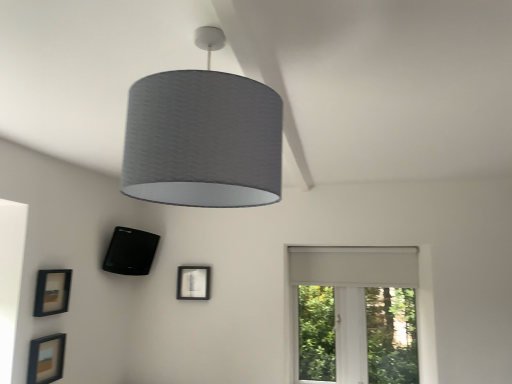
What do you see at coordinates (203, 137) in the screenshot?
I see `textured gray lampshade at center` at bounding box center [203, 137].

Measure the distance between point (61, 275) and camera.

Point (61, 275) is 2.58 meters from camera.

The image size is (512, 384). What do you see at coordinates (46, 359) in the screenshot? I see `matte black picture frame at lower left, arranged as the 1th picture frame when viewed from the front` at bounding box center [46, 359].

What is the approximate width of white matte window at right?

white matte window at right is 4.70 inches wide.

At what (x,y) coordinates should I click in order to perform the action: click on white matte window at right. Please return your answer as a coordinate pair (x, y). This screenshot has height=384, width=512. Looking at the image, I should click on (362, 300).

Find the location of `black matte speaker at lower left, acting as the first picture frame starting from the right`. black matte speaker at lower left, acting as the first picture frame starting from the right is located at coordinates (130, 252).

From a real-world perspective, is black matte speaker at lower left, which ranks as the third picture frame in front-to-back order, under white matte window at right?

Actually, black matte speaker at lower left, which ranks as the third picture frame in front-to-back order, is physically above white matte window at right in the real world.

Which object is positioned more to the right, black matte speaker at lower left, which ranks as the third picture frame in front-to-back order, or white matte window at right?

Positioned to the right is white matte window at right.

Looking at their sizes, would you say black matte speaker at lower left, the first picture frame viewed from the back, is wider or thinner than white matte window at right?

In the image, black matte speaker at lower left, the first picture frame viewed from the back, appears to be wider than white matte window at right.

Can white matte window at right be found inside black matte speaker at lower left, the first picture frame viewed from the back?

Actually, white matte window at right is outside black matte speaker at lower left, the first picture frame viewed from the back.

How much distance is there between textured gray lampshade at center and matte black picture frame at lower left, marked as the 2th picture frame in a left-to-right arrangement?

textured gray lampshade at center and matte black picture frame at lower left, marked as the 2th picture frame in a left-to-right arrangement, are 5.85 feet apart from each other.

Which object is more forward, textured gray lampshade at center or matte black picture frame at lower left, the second picture frame positioned from the front?

textured gray lampshade at center is closer to the camera.

What's the angular difference between textured gray lampshade at center and matte black picture frame at lower left, placed as the 2th picture frame when sorted from right to left,'s facing directions?

textured gray lampshade at center and matte black picture frame at lower left, placed as the 2th picture frame when sorted from right to left, are facing 94 degrees away from each other.

Between textured gray lampshade at center and matte black picture frame at lower left, the second picture frame positioned from the front, which one has more height?

Standing taller between the two is textured gray lampshade at center.

Is white matte window at right located outside textured gray lampshade at center?

white matte window at right lies outside textured gray lampshade at center's area.

Considering the relative sizes of white matte window at right and textured gray lampshade at center in the image provided, is white matte window at right bigger than textured gray lampshade at center?

Yes.

Which is in front, point (385, 266) or point (264, 117)?

The point (264, 117) is closer to the camera.

Is white matte window at right wider or thinner than textured gray lampshade at center?

Considering their sizes, white matte window at right looks slimmer than textured gray lampshade at center.

Are matte black picture frame at lower left, placed as the 2th picture frame when sorted from right to left, and white matte window at right far apart?

Yes, matte black picture frame at lower left, placed as the 2th picture frame when sorted from right to left, and white matte window at right are quite far apart.

How many degrees apart are the facing directions of matte black picture frame at lower left, placed as the 2th picture frame when sorted from right to left, and white matte window at right?

They differ by 91.8 degrees in their facing directions.

Which of these two, matte black picture frame at lower left, the 2th picture frame positioned from the back, or white matte window at right, is thinner?

Thinner between the two is matte black picture frame at lower left, the 2th picture frame positioned from the back.

Considering the positions of objects matte black picture frame at lower left, the second picture frame positioned from the front, and white matte window at right in the image provided, who is more to the left, matte black picture frame at lower left, the second picture frame positioned from the front, or white matte window at right?

From the viewer's perspective, matte black picture frame at lower left, the second picture frame positioned from the front, appears more on the left side.

Is black matte speaker at lower left, the first picture frame viewed from the back, far from textured gray lampshade at center?

Indeed, black matte speaker at lower left, the first picture frame viewed from the back, is not near textured gray lampshade at center.

Which object is positioned more to the right, black matte speaker at lower left, acting as the first picture frame starting from the right, or textured gray lampshade at center?

From the viewer's perspective, textured gray lampshade at center appears more on the right side.

Find the location of a particular element. lamp above the black matte speaker at lower left, arranged as the 3th picture frame when viewed from the left (from the image's perspective) is located at coordinates (203, 137).

Is point (115, 253) positioned in front of point (252, 189)?

That is False.

Considering the relative sizes of matte black picture frame at lower left, the second picture frame positioned from the front, and textured gray lampshade at center in the image provided, is matte black picture frame at lower left, the second picture frame positioned from the front, wider than textured gray lampshade at center?

No.

Is point (45, 303) positioned before point (189, 121)?

No, (45, 303) is further to viewer.

Considering the sizes of objects matte black picture frame at lower left, placed as the 2th picture frame when sorted from right to left, and textured gray lampshade at center in the image provided, who is taller, matte black picture frame at lower left, placed as the 2th picture frame when sorted from right to left, or textured gray lampshade at center?

textured gray lampshade at center is taller.

From a real-world perspective, is matte black picture frame at lower left, the 2th picture frame positioned from the back, physically located above or below matte black picture frame at lower left, the third picture frame from the right?

Clearly, from a real-world perspective, matte black picture frame at lower left, the 2th picture frame positioned from the back, is above matte black picture frame at lower left, the third picture frame from the right.

Considering the positions of objects matte black picture frame at lower left, the 2th picture frame positioned from the back, and matte black picture frame at lower left, which is the 1th picture frame in left-to-right order, in the image provided, who is in front, matte black picture frame at lower left, the 2th picture frame positioned from the back, or matte black picture frame at lower left, which is the 1th picture frame in left-to-right order,?

matte black picture frame at lower left, which is the 1th picture frame in left-to-right order.

Is matte black picture frame at lower left, marked as the 2th picture frame in a left-to-right arrangement, surrounding matte black picture frame at lower left, the third picture frame from the right?

No, matte black picture frame at lower left, the third picture frame from the right, is not a part of matte black picture frame at lower left, marked as the 2th picture frame in a left-to-right arrangement.

Does matte black picture frame at lower left, placed as the 2th picture frame when sorted from right to left, have a larger size compared to matte black picture frame at lower left, the third picture frame from the right?

No.

Find the location of a particular element. window behind the black matte speaker at lower left, acting as the first picture frame starting from the right is located at coordinates (362, 300).

This screenshot has height=384, width=512. In order to click on lamp that appears in front of the matte black picture frame at lower left, the second picture frame positioned from the front in this screenshot , I will do `click(203, 137)`.

Which object lies nearer to the anchor point black matte speaker at lower left, the first picture frame viewed from the back, textured gray lampshade at center or matte black picture frame at lower left, marked as the 2th picture frame in a left-to-right arrangement?

Based on the image, matte black picture frame at lower left, marked as the 2th picture frame in a left-to-right arrangement, appears to be nearer to black matte speaker at lower left, the first picture frame viewed from the back.

Consider the image. Which object lies nearer to the anchor point black matte speaker at lower left, the first picture frame viewed from the back, matte black picture frame at lower left, the 3th picture frame viewed from the back, or textured gray lampshade at center?

matte black picture frame at lower left, the 3th picture frame viewed from the back, is closer to black matte speaker at lower left, the first picture frame viewed from the back.

Which object lies further to the anchor point white matte window at right, matte black picture frame at lower left, the 2th picture frame positioned from the back, or textured gray lampshade at center?

Among the two, textured gray lampshade at center is located further to white matte window at right.

Estimate the real-world distances between objects in this image. Which object is further from textured gray lampshade at center, black matte speaker at lower left, arranged as the 3th picture frame when viewed from the left, or white matte window at right?

white matte window at right is further to textured gray lampshade at center.

From the image, which object appears to be farther from black matte speaker at lower left, the first picture frame viewed from the back, matte black picture frame at lower left, placed as the 2th picture frame when sorted from right to left, or matte black picture frame at lower left, which is the 1th picture frame in left-to-right order?

matte black picture frame at lower left, which is the 1th picture frame in left-to-right order, is further to black matte speaker at lower left, the first picture frame viewed from the back.

Which object lies nearer to the anchor point matte black picture frame at lower left, the third picture frame from the right, textured gray lampshade at center or matte black picture frame at lower left, placed as the 2th picture frame when sorted from right to left?

matte black picture frame at lower left, placed as the 2th picture frame when sorted from right to left, is closer to matte black picture frame at lower left, the third picture frame from the right.

When comparing their distances from matte black picture frame at lower left, which is the 1th picture frame in left-to-right order, does white matte window at right or black matte speaker at lower left, which ranks as the third picture frame in front-to-back order, seem further?

white matte window at right is further to matte black picture frame at lower left, which is the 1th picture frame in left-to-right order.

Which object lies further to the anchor point white matte window at right, textured gray lampshade at center or matte black picture frame at lower left, marked as the 2th picture frame in a left-to-right arrangement?

Based on the image, textured gray lampshade at center appears to be further to white matte window at right.

Find the location of a particular element. picture frame located between textured gray lampshade at center and matte black picture frame at lower left, placed as the 2th picture frame when sorted from right to left, in the depth direction is located at coordinates (46, 359).

You are a GUI agent. You are given a task and a screenshot of the screen. Output one action in this format:
    pyautogui.click(x=<x>, y=<y>)
    Task: Click on the picture frame between matte black picture frame at lower left, the third picture frame from the right, and black matte speaker at lower left, the first picture frame viewed from the back, along the z-axis
    
    Given the screenshot: What is the action you would take?
    pyautogui.click(x=52, y=292)

Locate an element on the screen. picture frame between matte black picture frame at lower left, marked as the 2th picture frame in a left-to-right arrangement, and white matte window at right is located at coordinates (130, 252).